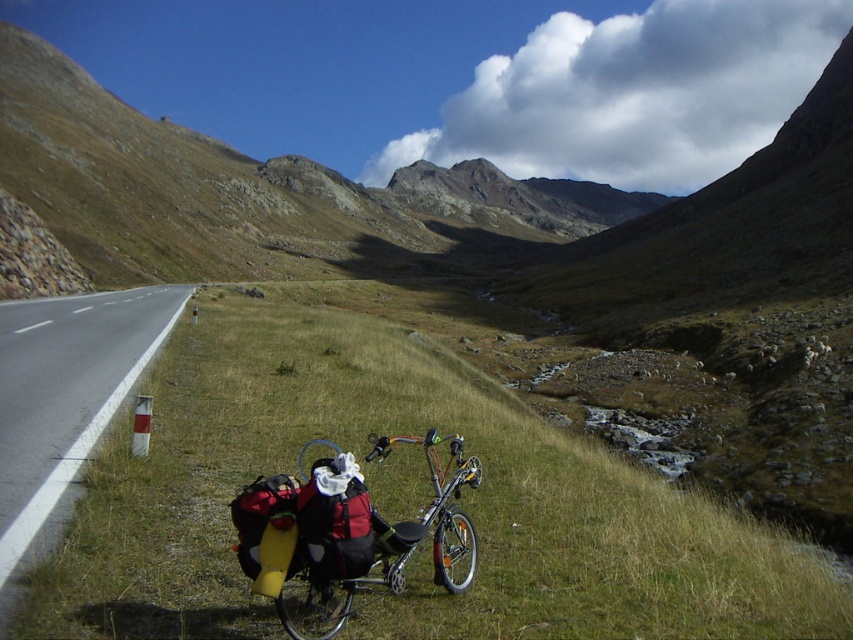
Question: Which of the following is the closest to the observer?

Choices:
 (A) shiny metallic bicycle at lower center
 (B) rugged stone mountain at center

Answer: (A)

Question: Among these points, which one is nearest to the camera?

Choices:
 (A) (67, 481)
 (B) (366, 582)
 (C) (440, 204)

Answer: (B)

Question: Which point appears farthest from the camera in this image?

Choices:
 (A) (49, 339)
 (B) (96, 253)

Answer: (B)

Question: Is rugged stone mountain at center smaller than white asphalt road at lower left?

Choices:
 (A) yes
 (B) no

Answer: (B)

Question: Does rugged stone mountain at center appear on the right side of shiny metallic bicycle at lower center?

Choices:
 (A) yes
 (B) no

Answer: (A)

Question: Is rugged stone mountain at center bigger than shiny metallic bicycle at lower center?

Choices:
 (A) yes
 (B) no

Answer: (A)